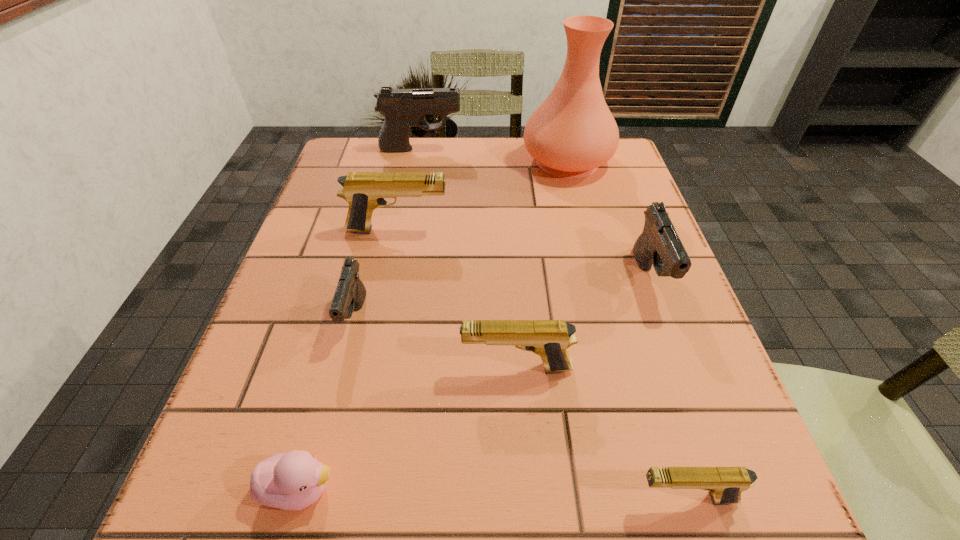
Find the location of a particular element. vase is located at coordinates (572, 133).

Find the location of a particular element. the second tallest object is located at coordinates (402, 108).

Identify the location of the biggest black pistol. (402, 108).

Locate an element on the screen. Image resolution: width=960 pixels, height=540 pixels. the farthest tan pistol is located at coordinates coord(364,191).

Locate an element on the screen. the biggest tan pistol is located at coordinates (364, 191).

At what (x,y) coordinates should I click in order to perform the action: click on the rightmost black pistol. Please return your answer as a coordinate pair (x, y). This screenshot has width=960, height=540. Looking at the image, I should click on (659, 244).

The height and width of the screenshot is (540, 960). I want to click on the second tan pistol from left to right, so click(x=549, y=339).

At what (x,y) coordinates should I click in order to perform the action: click on the third pistol from right to left. Please return your answer as a coordinate pair (x, y). The image size is (960, 540). Looking at the image, I should click on (549, 339).

Find the location of a particular element. the smallest black pistol is located at coordinates (350, 294).

Where is `pink duckling`? This screenshot has width=960, height=540. pink duckling is located at coordinates (289, 481).